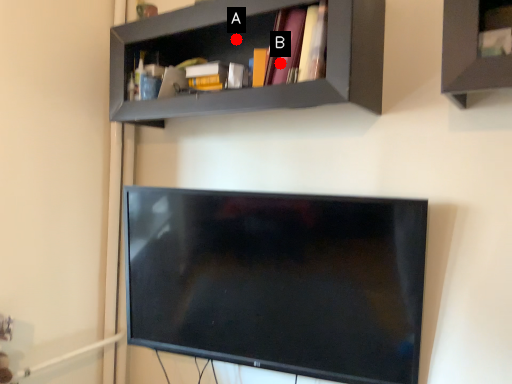
Question: Two points are circled on the image, labeled by A and B beside each circle. Which point appears closest to the camera in this image?

Choices:
 (A) A is closer
 (B) B is closer

Answer: (B)